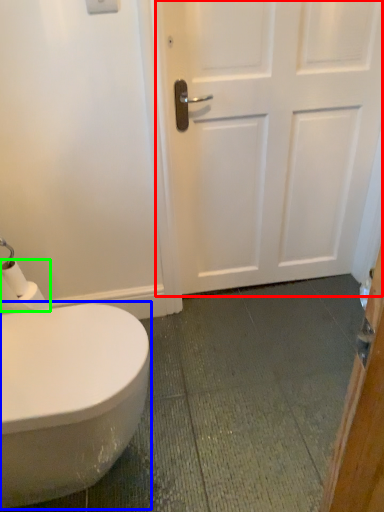
Question: Which is nearer to the door (highlighted by a red box)? bidet (highlighted by a blue box) or toilet paper (highlighted by a green box).

Choices:
 (A) bidet
 (B) toilet paper

Answer: (A)